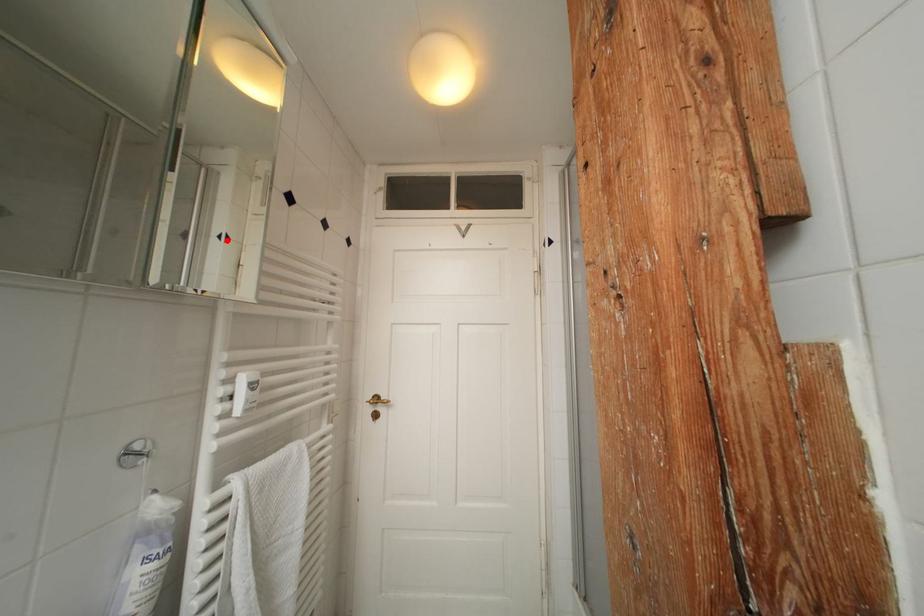
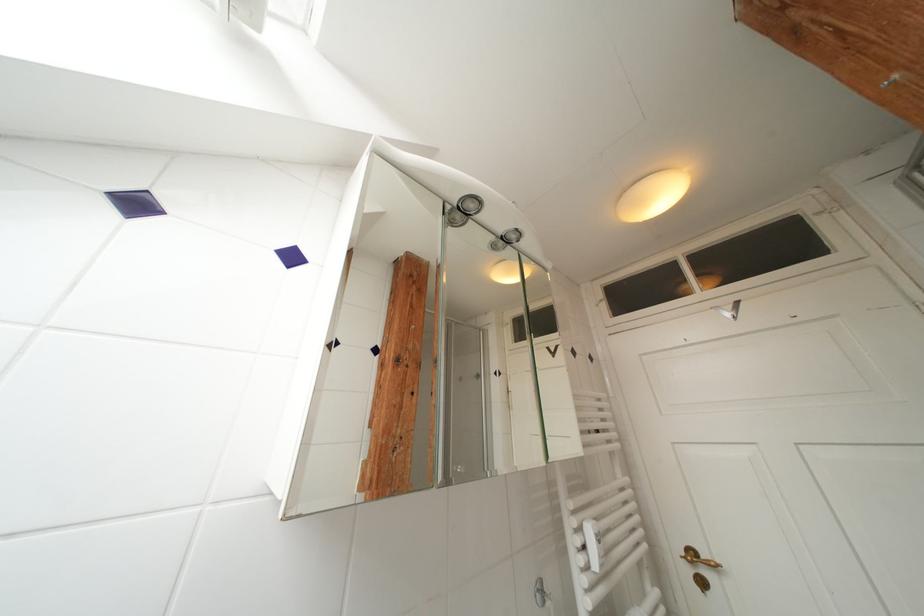
Find the pixel in the second image that matches the highlighted location in the first image.

(502, 377)